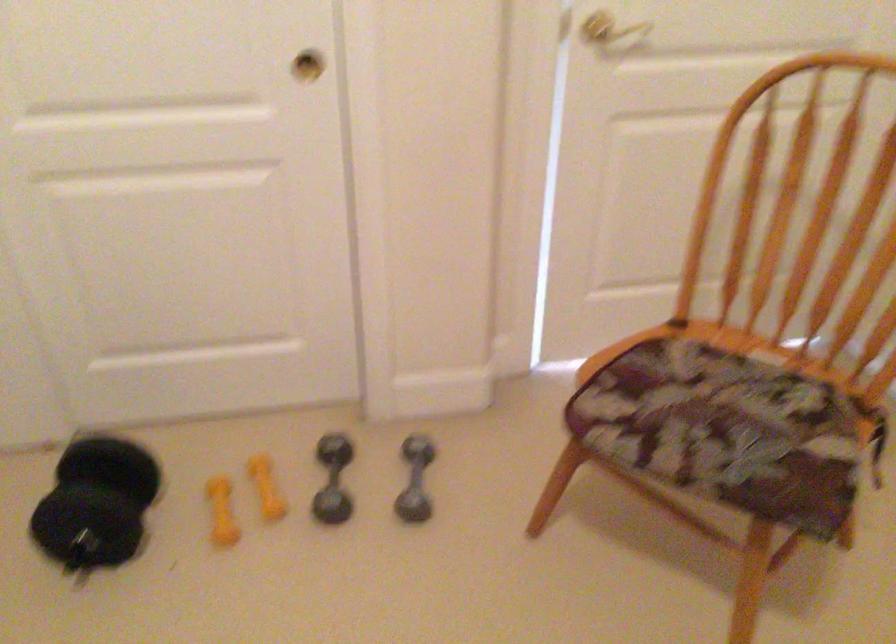
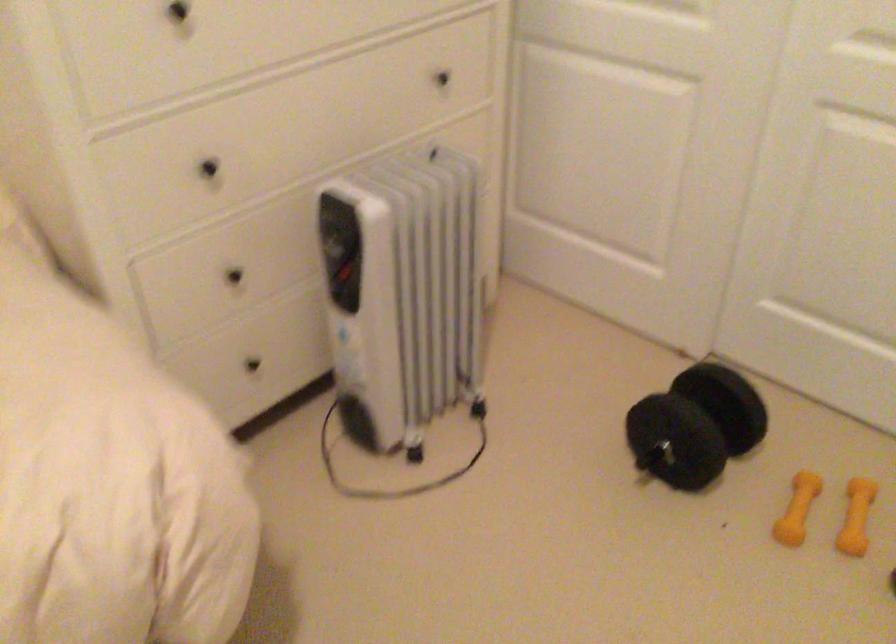
Locate, in the second image, the point that corresponds to the point at 115,498 in the first image.

(695, 426)